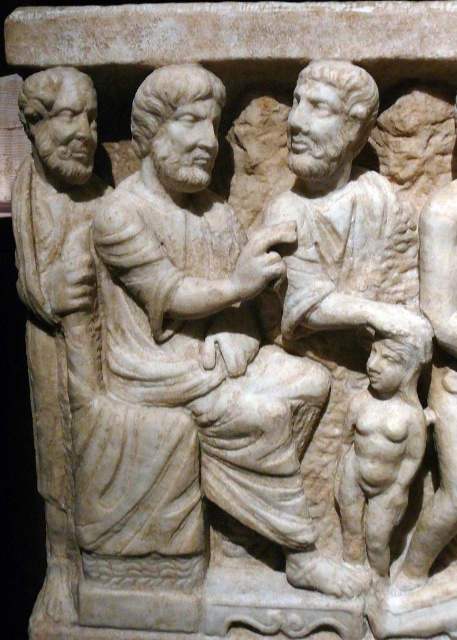
Question: Is white marble child at right above white marble child at lower right?

Choices:
 (A) no
 (B) yes

Answer: (B)

Question: Does white marble child at right lie behind white marble child at lower right?

Choices:
 (A) yes
 (B) no

Answer: (B)

Question: In this image, where is white marble child at right located relative to white marble child at lower right?

Choices:
 (A) above
 (B) below

Answer: (A)

Question: Which point is closer to the camera?

Choices:
 (A) white marble child at lower right
 (B) white marble child at right

Answer: (B)

Question: Which point appears farthest from the camera in this image?

Choices:
 (A) (410, 346)
 (B) (409, 241)

Answer: (B)